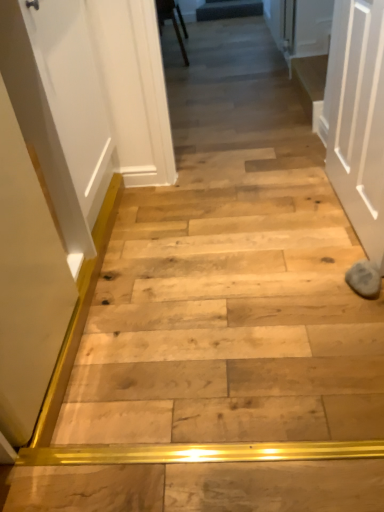
Find the location of a particular element. This screenshot has width=384, height=512. free space underneath white matte door at right (from a real-world perspective) is located at coordinates pos(342,210).